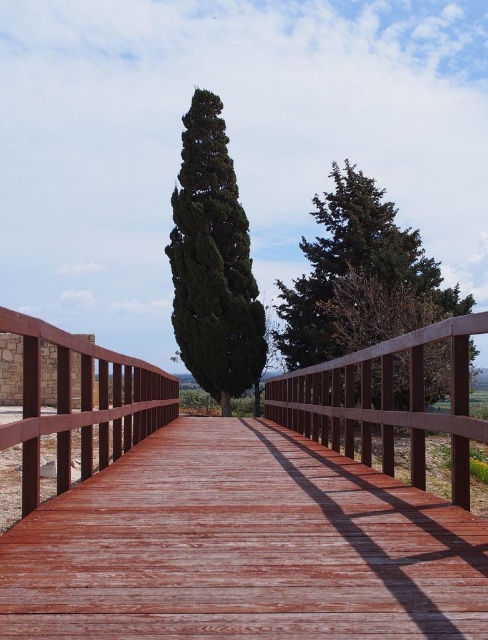
Looking at this image, is green matte tree at center further to the viewer compared to wooden fence at center?

Yes, green matte tree at center is further from the viewer.

The width and height of the screenshot is (488, 640). I want to click on green matte tree at center, so click(214, 262).

Identify the location of green matte tree at center. (214, 262).

Measure the distance between point (x=336, y=420) and camera.

Point (x=336, y=420) is 9.60 meters away from camera.

What are the coordinates of `wooden bridge at center` in the screenshot? It's located at (243, 508).

Image resolution: width=488 pixels, height=640 pixels. In order to click on wooden bridge at center in this screenshot , I will do `click(243, 508)`.

Can you confirm if wooden bridge at center is positioned below green textured tree at upper center?

Yes, wooden bridge at center is below green textured tree at upper center.

Based on the photo, how distant is wooden bridge at center from green textured tree at upper center?

They are 21.80 feet apart.

The height and width of the screenshot is (640, 488). I want to click on wooden bridge at center, so click(243, 508).

I want to click on wooden bridge at center, so click(x=243, y=508).